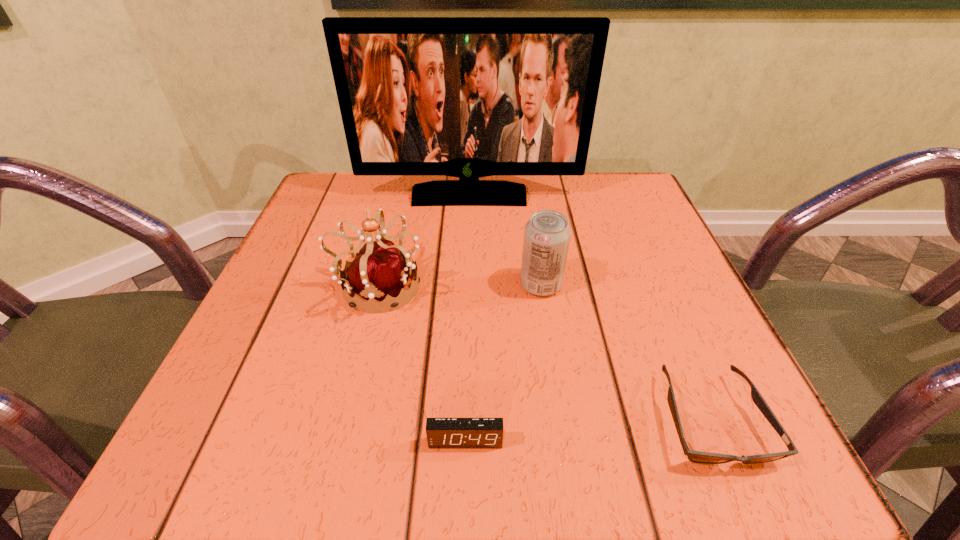
The height and width of the screenshot is (540, 960). What are the coordinates of `blank area in the image that satisfies the following two spatial constraints: 1. on the front-facing side of the monitor; 2. on the left side of the soda can` in the screenshot? It's located at (467, 285).